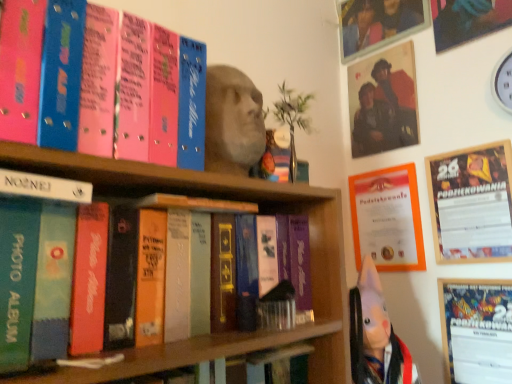
You are a GUI agent. You are given a task and a screenshot of the screen. Output one action in this format:
    pyautogui.click(x=<x>, y=<y>)
    Task: Click on the matte plastic photo frame at upper right, the first picture frame viewed from the left
    Image resolution: width=512 pixels, height=384 pixels.
    Given the screenshot: What is the action you would take?
    pyautogui.click(x=383, y=102)

The image size is (512, 384). What do you see at coordinates (477, 330) in the screenshot?
I see `white paper at lower right` at bounding box center [477, 330].

Locate an element on the screen. The image size is (512, 384). orange paper certificate at upper right is located at coordinates (387, 218).

From the image's perspective, is orange paper certificate at upper right below matte plastic photo frame at upper right, placed as the first picture frame when sorted from top to bottom?

Yes, from the image's perspective, orange paper certificate at upper right is beneath matte plastic photo frame at upper right, placed as the first picture frame when sorted from top to bottom.

Is orange paper certificate at upper right next to matte plastic photo frame at upper right, the 2th picture frame positioned from the right, and touching it?

No, orange paper certificate at upper right is not next to matte plastic photo frame at upper right, the 2th picture frame positioned from the right.

Is orange paper certificate at upper right turned away from matte plastic photo frame at upper right, placed as the first picture frame when sorted from top to bottom?

No.

Does orange paper certificate at upper right come in front of matte plastic photo frame at upper right, the first picture frame viewed from the left?

Yes, orange paper certificate at upper right is closer to the viewer.

Is white matte photo album at left, marked as the 2th book in a top-to-bottom arrangement, completely or partially inside white plastic clock at upper right?

Actually, white matte photo album at left, marked as the 2th book in a top-to-bottom arrangement, is outside white plastic clock at upper right.

From the image's perspective, relative to white matte photo album at left, marked as the 2th book in a top-to-bottom arrangement, is white plastic clock at upper right above or below?

white plastic clock at upper right is situated higher than white matte photo album at left, marked as the 2th book in a top-to-bottom arrangement, in the image.

Is white plastic clock at upper right closer to the viewer compared to white matte photo album at left, which appears as the 1th book when ordered from the bottom?

No, white plastic clock at upper right is behind white matte photo album at left, which appears as the 1th book when ordered from the bottom.

Considering the positions of objects white plastic clock at upper right and white matte photo album at left, marked as the 2th book in a top-to-bottom arrangement, in the image provided, who is more to the left, white plastic clock at upper right or white matte photo album at left, marked as the 2th book in a top-to-bottom arrangement,?

From the viewer's perspective, white matte photo album at left, marked as the 2th book in a top-to-bottom arrangement, appears more on the left side.

Does white matte photo album at left, which appears as the 1th book when ordered from the bottom, have a greater height compared to pink matte photo album at upper left, positioned as the second book in bottom-to-top order?

No, white matte photo album at left, which appears as the 1th book when ordered from the bottom, is not taller than pink matte photo album at upper left, positioned as the second book in bottom-to-top order.

In order to click on book located above the white matte photo album at left, marked as the 2th book in a top-to-bottom arrangement (from a real-world perspective) in this screenshot , I will do `click(101, 83)`.

Which object is further away from the camera taking this photo, white matte photo album at left, marked as the 2th book in a top-to-bottom arrangement, or pink matte photo album at upper left, the 1th book positioned from the top?

pink matte photo album at upper left, the 1th book positioned from the top, is further away from the camera.

Does white matte photo album at left, marked as the 2th book in a top-to-bottom arrangement, appear on the right side of pink matte photo album at upper left, the 1th book positioned from the top?

Incorrect, white matte photo album at left, marked as the 2th book in a top-to-bottom arrangement, is not on the right side of pink matte photo album at upper left, the 1th book positioned from the top.

Is pink matte photo album at upper left, the 1th book positioned from the top, a part of orange paper certificate at upper right?

No, pink matte photo album at upper left, the 1th book positioned from the top, is not inside orange paper certificate at upper right.

How far apart are orange paper certificate at upper right and pink matte photo album at upper left, positioned as the second book in bottom-to-top order?

orange paper certificate at upper right and pink matte photo album at upper left, positioned as the second book in bottom-to-top order, are 35.42 inches apart.

Is orange paper certificate at upper right wider or thinner than pink matte photo album at upper left, positioned as the second book in bottom-to-top order?

Considering their sizes, orange paper certificate at upper right looks slimmer than pink matte photo album at upper left, positioned as the second book in bottom-to-top order.

Looking at the image, does orange paper certificate at upper right seem bigger or smaller compared to pink matte photo album at upper left, the 1th book positioned from the top?

Considering their sizes, orange paper certificate at upper right takes up less space than pink matte photo album at upper left, the 1th book positioned from the top.

From the image's perspective, is orange paper certificate at upper right over wooden frame at upper right, which is the 2th picture frame in top-to-bottom order?

Incorrect, from the image's perspective, orange paper certificate at upper right is lower than wooden frame at upper right, which is the 2th picture frame in top-to-bottom order.

Is point (391, 246) closer or farther from the camera than point (474, 150)?

Point (391, 246) appears to be farther away from the viewer than point (474, 150).

Is orange paper certificate at upper right taller than wooden frame at upper right, the second picture frame when ordered from left to right?

No.

Is wooden frame at upper right, which is the 2th picture frame in top-to-bottom order, completely or partially inside orange paper certificate at upper right?

No, orange paper certificate at upper right does not contain wooden frame at upper right, which is the 2th picture frame in top-to-bottom order.

Consider the image. How different are the orientations of white matte photo album at left, which appears as the 1th book when ordered from the bottom, and matte plastic photo frame at upper right, arranged as the 2th picture frame when ordered from the bottom, in degrees?

92.1 degrees separate the facing orientations of white matte photo album at left, which appears as the 1th book when ordered from the bottom, and matte plastic photo frame at upper right, arranged as the 2th picture frame when ordered from the bottom.

From a real-world perspective, between white matte photo album at left, which appears as the 1th book when ordered from the bottom, and matte plastic photo frame at upper right, arranged as the 2th picture frame when ordered from the bottom, who is vertically higher?

matte plastic photo frame at upper right, arranged as the 2th picture frame when ordered from the bottom, from a real-world perspective.

Is point (46, 196) closer to viewer compared to point (387, 108)?

Yes, point (46, 196) is in front of point (387, 108).

Between white matte photo album at left, marked as the 2th book in a top-to-bottom arrangement, and matte plastic photo frame at upper right, acting as the 2th picture frame starting from the front, which one has more height?

matte plastic photo frame at upper right, acting as the 2th picture frame starting from the front, is taller.

Is point (145, 138) less distant than point (508, 87)?

Yes, point (145, 138) is closer to viewer.

Looking at this image, is pink matte photo album at upper left, positioned as the second book in bottom-to-top order, placed right next to white plastic clock at upper right?

They are not placed beside each other.

Is pink matte photo album at upper left, the 1th book positioned from the top, positioned with its back to white plastic clock at upper right?

No.

Locate an element on the screen. This screenshot has width=512, height=384. poster page that appears below the matte plastic photo frame at upper right, acting as the 2th picture frame starting from the front (from a real-world perspective) is located at coordinates (387, 218).

The width and height of the screenshot is (512, 384). I want to click on clock behind the white matte photo album at left, marked as the 2th book in a top-to-bottom arrangement, so click(503, 82).

Considering their positions, is matte plastic photo frame at upper right, arranged as the 2th picture frame when ordered from the bottom, positioned further to wooden frame at upper right, which is the 2th picture frame in top-to-bottom order, than white plastic clock at upper right?

matte plastic photo frame at upper right, arranged as the 2th picture frame when ordered from the bottom.

Considering their positions, is orange paper certificate at upper right positioned further to wooden frame at upper right, which is the 2th picture frame in top-to-bottom order, than matte plastic photo frame at upper right, the first picture frame viewed from the left?

matte plastic photo frame at upper right, the first picture frame viewed from the left.

Which object lies nearer to the anchor point matte plastic photo frame at upper right, the first picture frame viewed from the left, pink matte photo album at upper left, positioned as the second book in bottom-to-top order, or white matte photo album at left, which appears as the 1th book when ordered from the bottom?

pink matte photo album at upper left, positioned as the second book in bottom-to-top order, is positioned closer to the anchor matte plastic photo frame at upper right, the first picture frame viewed from the left.

Looking at the image, which one is located closer to matte plastic photo frame at upper right, acting as the 2th picture frame starting from the front, white paper at lower right or orange paper certificate at upper right?

orange paper certificate at upper right.

Looking at the image, which one is located further to white paper at lower right, matte plastic photo frame at upper right, the first picture frame viewed from the left, or wooden frame at upper right, the second picture frame when ordered from left to right?

Among the two, matte plastic photo frame at upper right, the first picture frame viewed from the left, is located further to white paper at lower right.

Considering their positions, is white matte photo album at left, which appears as the 1th book when ordered from the bottom, positioned further to white paper at lower right than white plastic clock at upper right?

white matte photo album at left, which appears as the 1th book when ordered from the bottom.

Which object lies further to the anchor point white matte photo album at left, which appears as the 1th book when ordered from the bottom, white plastic clock at upper right or wooden frame at upper right, marked as the 2th picture frame in a back-to-front arrangement?

white plastic clock at upper right is positioned further to the anchor white matte photo album at left, which appears as the 1th book when ordered from the bottom.

Looking at the image, which one is located closer to wooden frame at upper right, which is the 2th picture frame in top-to-bottom order, matte plastic photo frame at upper right, acting as the 2th picture frame starting from the front, or pink matte photo album at upper left, the 1th book positioned from the top?

matte plastic photo frame at upper right, acting as the 2th picture frame starting from the front, lies closer to wooden frame at upper right, which is the 2th picture frame in top-to-bottom order, than the other object.

You are a GUI agent. You are given a task and a screenshot of the screen. Output one action in this format:
    pyautogui.click(x=<x>, y=<y>)
    Task: Click on the poster page between white matte photo album at left, which appears as the 1th book when ordered from the bottom, and matte plastic photo frame at upper right, acting as the 2th picture frame starting from the front, from front to back
    This screenshot has width=512, height=384.
    Given the screenshot: What is the action you would take?
    pyautogui.click(x=387, y=218)

The width and height of the screenshot is (512, 384). Identify the location of poster page between white matte photo album at left, marked as the 2th book in a top-to-bottom arrangement, and wooden frame at upper right, the first picture frame positioned from the right, in the horizontal direction. (387, 218).

You are a GUI agent. You are given a task and a screenshot of the screen. Output one action in this format:
    pyautogui.click(x=<x>, y=<y>)
    Task: Click on the picture frame between pink matte photo album at upper left, the 1th book positioned from the top, and wooden frame at upper right, the second picture frame when ordered from left to right, in the horizontal direction
    Image resolution: width=512 pixels, height=384 pixels.
    Given the screenshot: What is the action you would take?
    pyautogui.click(x=383, y=102)

Find the location of a particular element. This screenshot has width=512, height=384. book positioned between white matte photo album at left, marked as the 2th book in a top-to-bottom arrangement, and orange paper certificate at upper right from near to far is located at coordinates (101, 83).